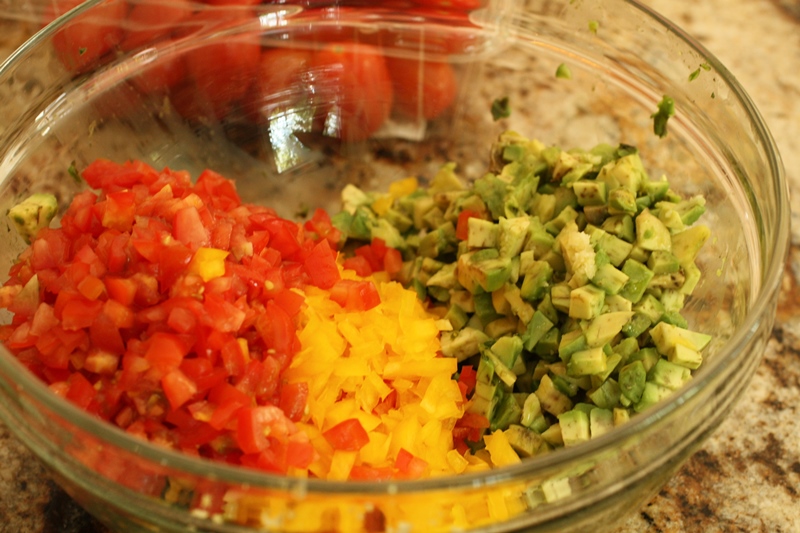
This screenshot has width=800, height=533. Identify the location of brown marble. (701, 466), (674, 500).